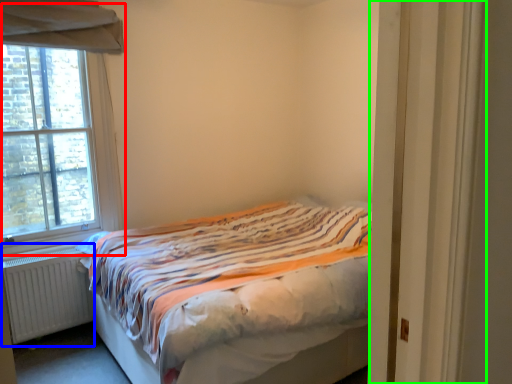
Question: Which object is the farthest from window (highlighted by a red box)? Choose among these: radiator (highlighted by a blue box) or door (highlighted by a green box).

Choices:
 (A) radiator
 (B) door

Answer: (B)